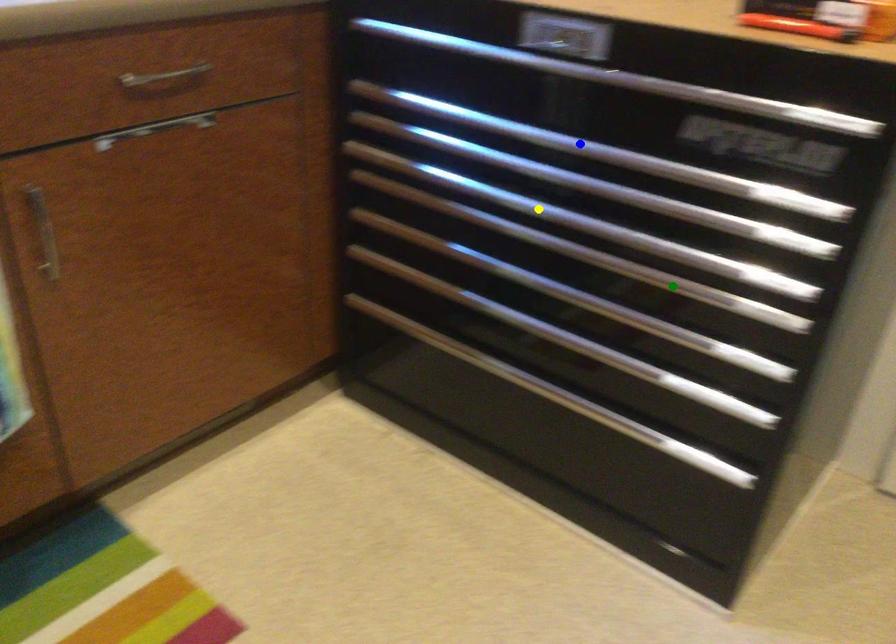
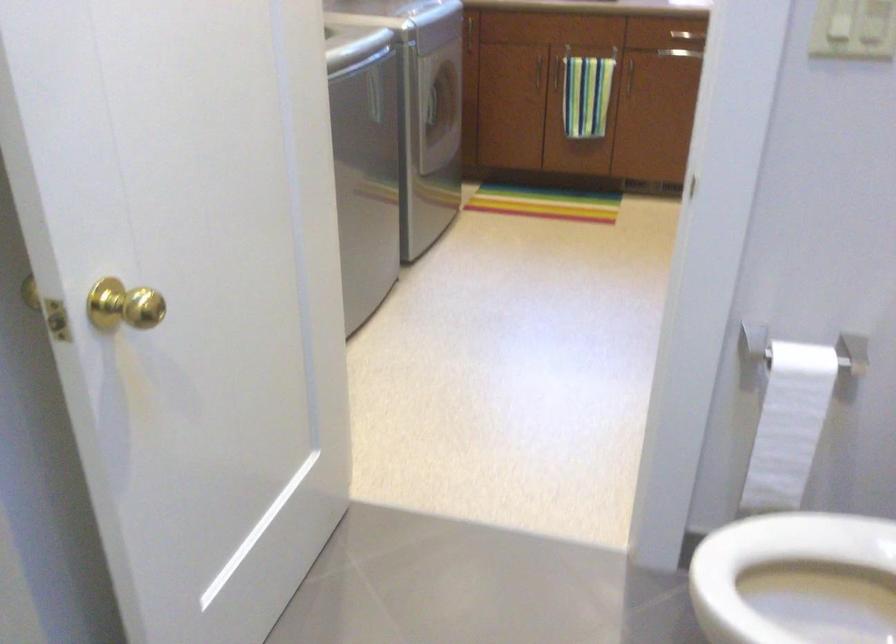
I am providing you with two images of the same scene from different viewpoints. Three points are marked in image1. Which point corresponds to a part or object that is occluded in image2?In image1, three points are marked. Which of them correspond to a part or object that is occluded in image2?Among the three points shown in image1, which one corresponds to a part or object that is no longer visible due to occlusion in image2?

Invisible in image2: blue point, green point, yellow point.